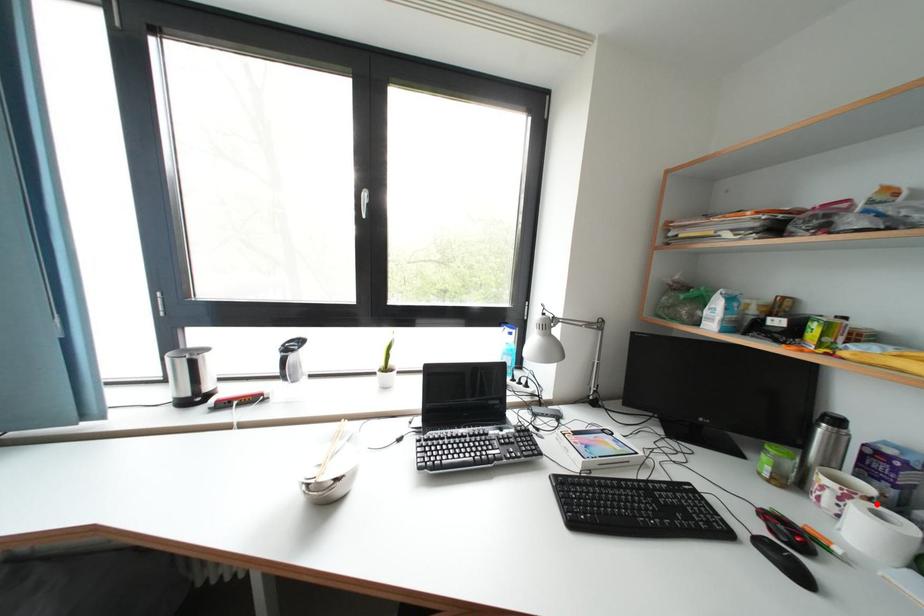
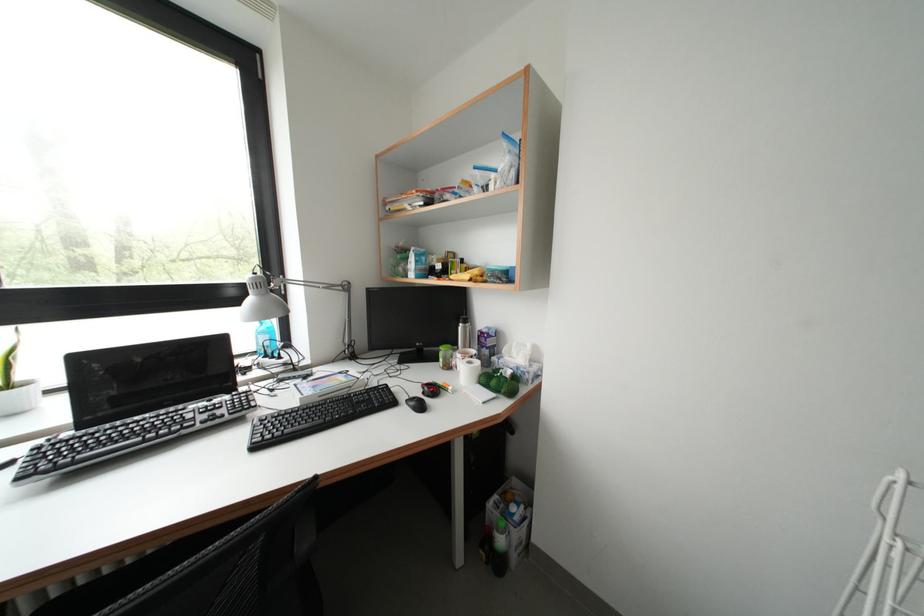
Locate, in the second image, the point that corresponds to the highlighted location in the first image.

(479, 362)